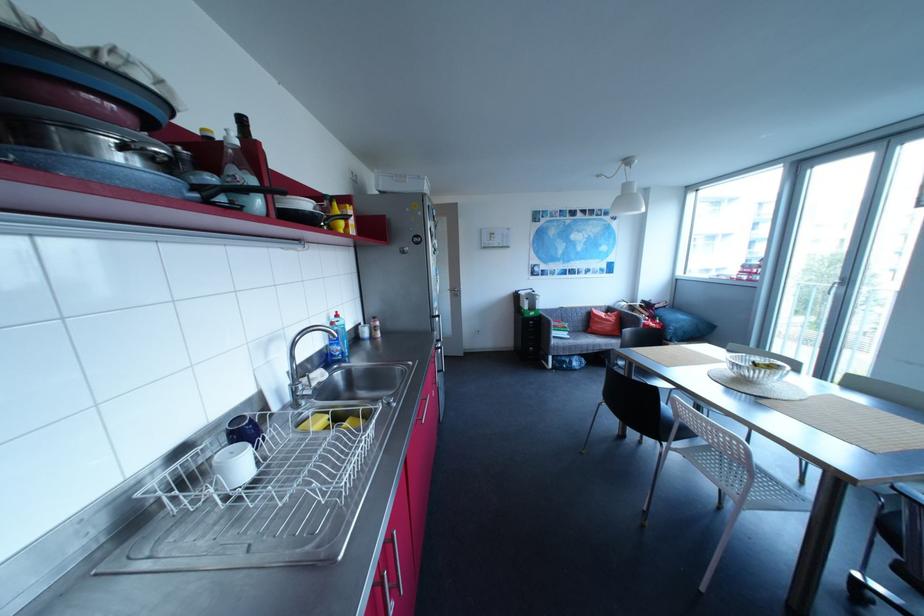
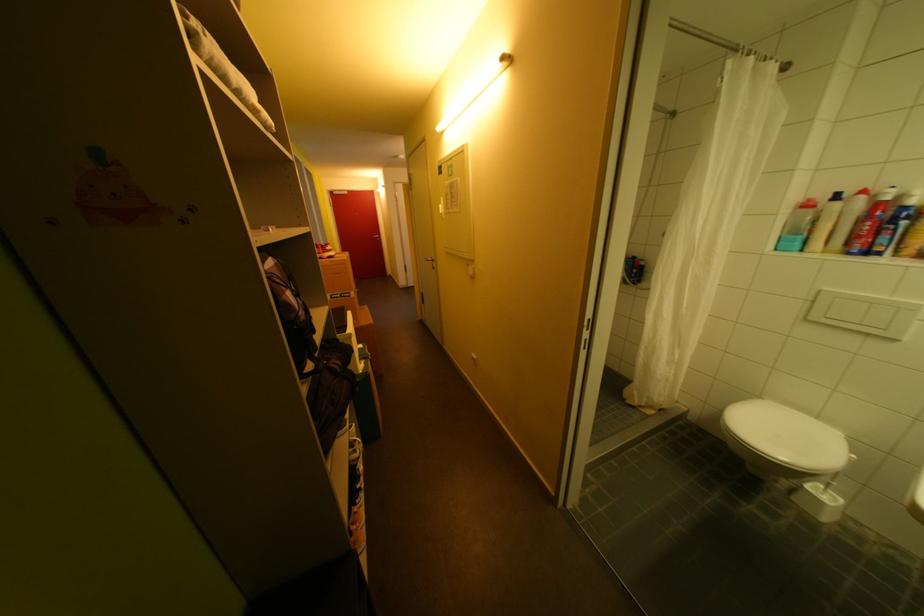
Question: In a continuous first-person perspective shot, in which direction is the camera moving?

Choices:
 (A) Left
 (B) Right
 (C) Forward
 (D) Backward

Answer: (A)